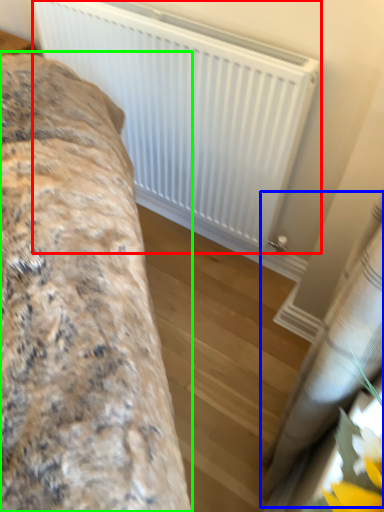
Question: Estimate the real-world distances between objects in this image. Which object is closer to radiator (highlighted by a red box), curtain (highlighted by a blue box) or furniture (highlighted by a green box)?

Choices:
 (A) curtain
 (B) furniture

Answer: (B)